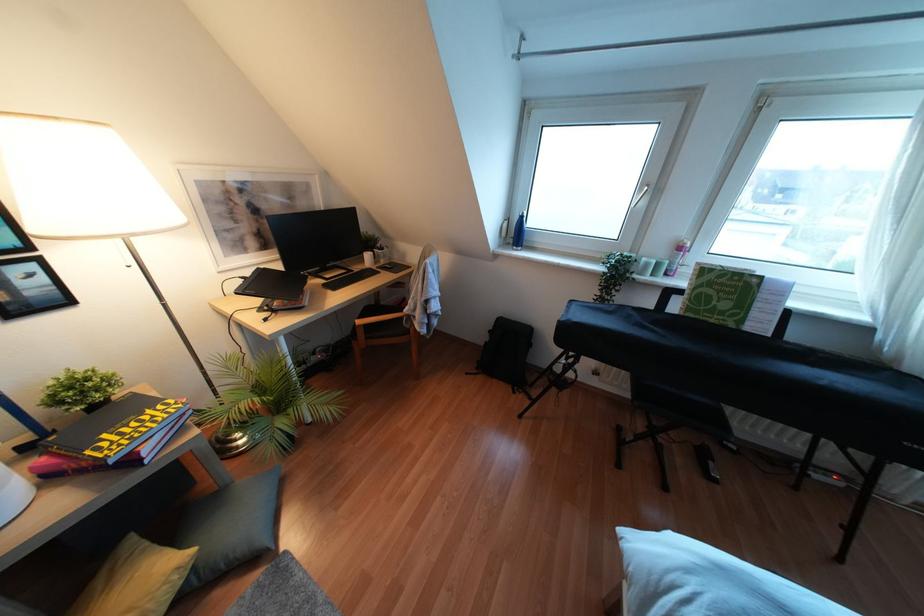
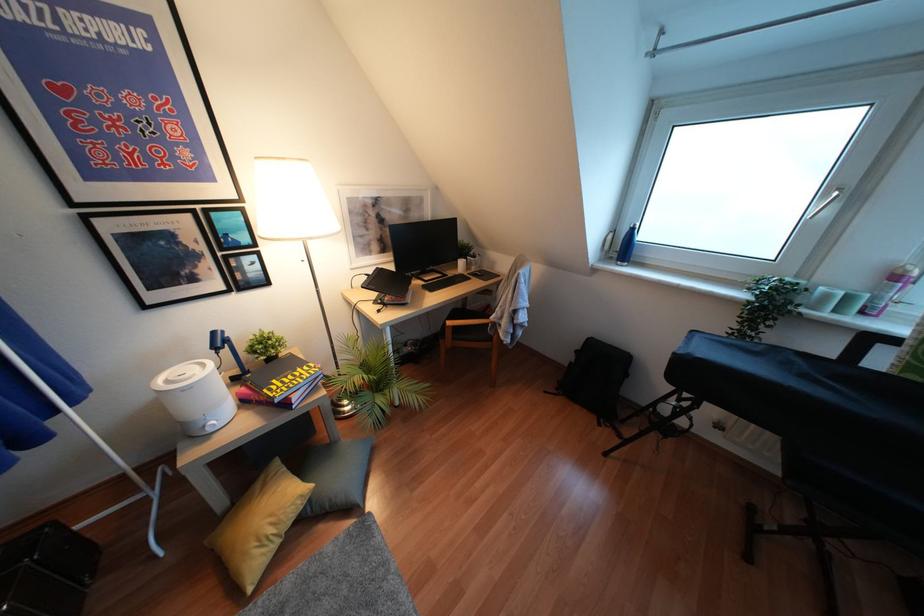
The point at (679, 246) is marked in the first image. Where is the corresponding point in the second image?

(895, 277)